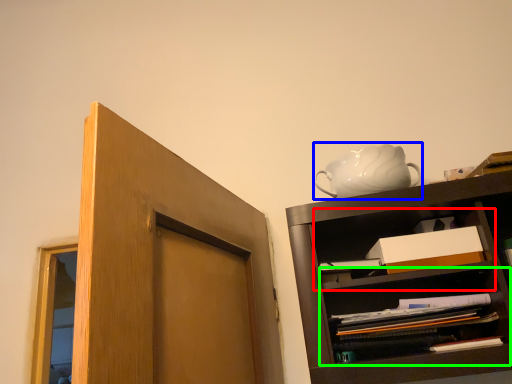
Question: Estimate the real-world distances between objects in this image. Which object is closer to cabinet (highlighted by a red box), tea pot (highlighted by a blue box) or shelf (highlighted by a green box)?

Choices:
 (A) tea pot
 (B) shelf

Answer: (B)